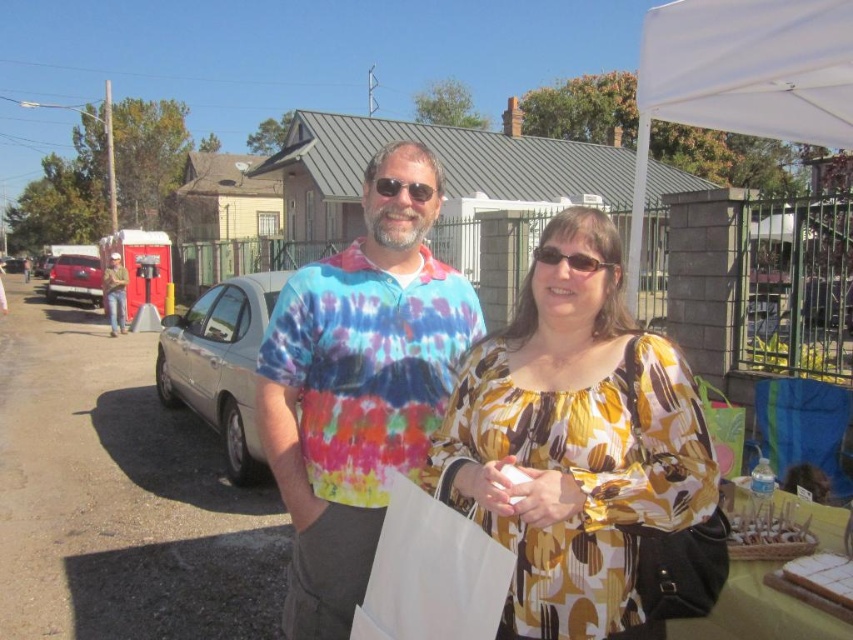
You are standing at the center of the image and want to move towards the white fabric canopy at upper right. Which direction should you face to walk straight towards it?

The white fabric canopy at upper right is located at point (750, 67), so you should face towards the upper right direction to walk straight towards it.